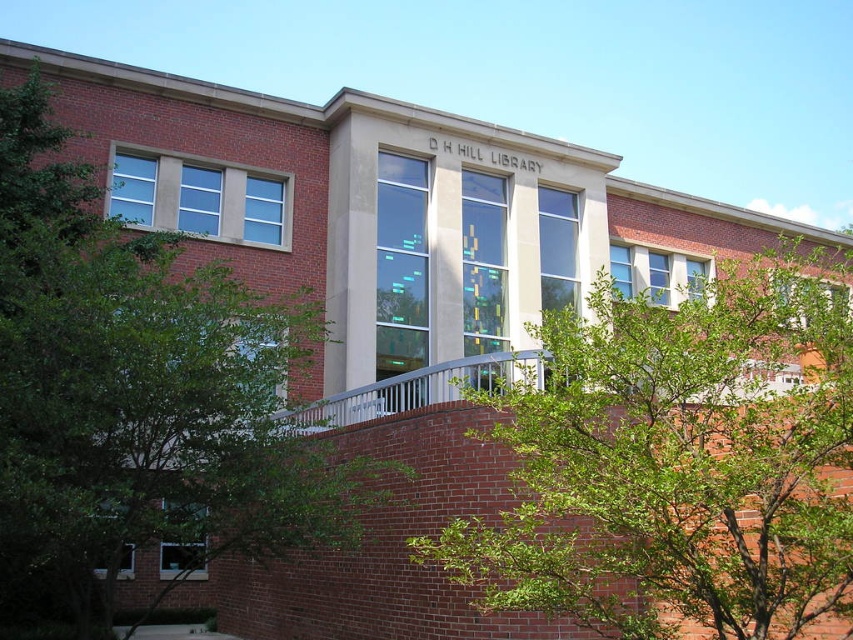
Question: Among these points, which one is farthest from the camera?

Choices:
 (A) (532, 362)
 (B) (691, 419)
 (C) (171, 481)

Answer: (A)

Question: Which object appears closest to the camera in this image?

Choices:
 (A) green leafy tree at center
 (B) white metal rail at center
 (C) green leafy tree at upper left

Answer: (A)

Question: Can you confirm if green leafy tree at center is wider than green leafy tree at upper left?

Choices:
 (A) no
 (B) yes

Answer: (B)

Question: Is green leafy tree at center closer to the viewer compared to white metal rail at center?

Choices:
 (A) yes
 (B) no

Answer: (A)

Question: Is green leafy tree at center smaller than white metal rail at center?

Choices:
 (A) yes
 (B) no

Answer: (B)

Question: Estimate the real-world distances between objects in this image. Which object is closer to the green leafy tree at center?

Choices:
 (A) green leafy tree at upper left
 (B) white metal rail at center

Answer: (B)